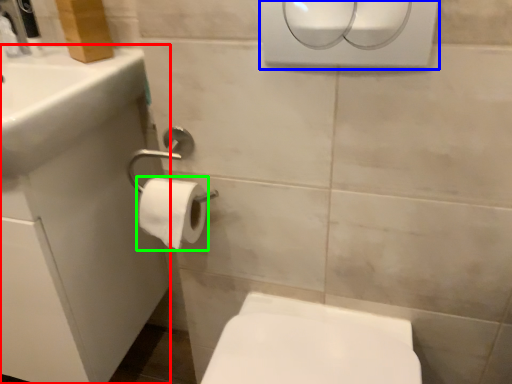
Question: Which is nearer to the porcelain (highlighted by a red box)? hand dryer (highlighted by a blue box) or toilet paper (highlighted by a green box).

Choices:
 (A) hand dryer
 (B) toilet paper

Answer: (B)